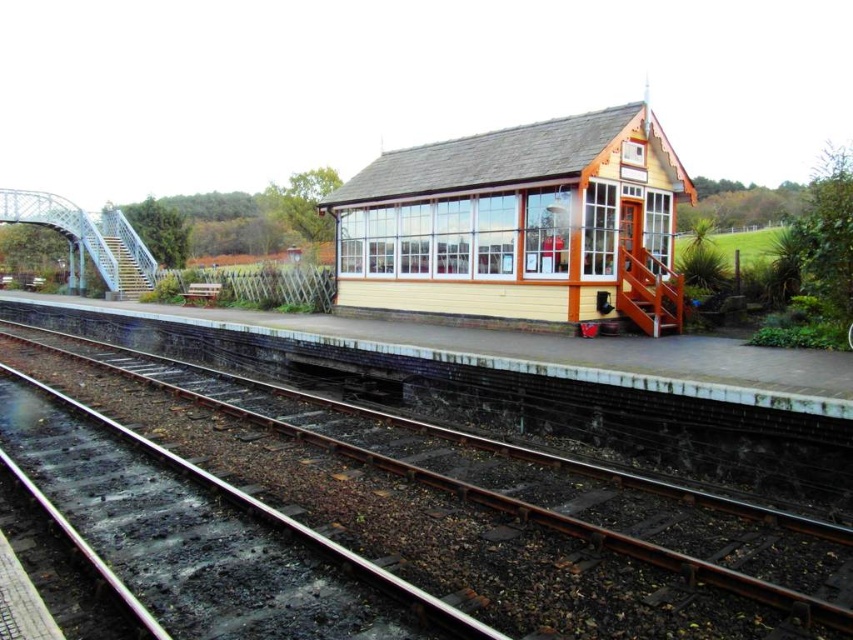
You are standing at the station platform and want to take a photo of the two points marked in the image. Which point, point (608, 636) or point (402, 252), will appear larger in your photo?

Point (608, 636) will appear larger in the photo because it is closer to the camera than point (402, 252).

You are a photographer standing on the platform at the railway station. You want to take a photo that includes both the smooth metal tracks at center and the yellow wood cabin at center. Which object should you focus on first to ensure both are in frame?

The smooth metal tracks at center are closer to the viewer than the yellow wood cabin at center. To ensure both are in frame, focus on the smooth metal tracks at center first as it is nearer, allowing the cabin to remain in the background within the same shot.